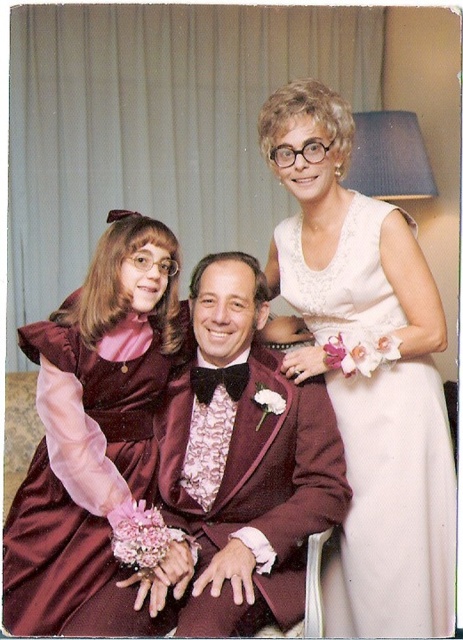
Question: Which point appears farthest from the camera in this image?

Choices:
 (A) (37, 618)
 (B) (435, 484)

Answer: (B)

Question: Does white satin dress at upper right appear over velvet burgundy dress at left?

Choices:
 (A) no
 (B) yes

Answer: (B)

Question: Does white satin dress at upper right have a greater width compared to velvet burgundy dress at left?

Choices:
 (A) yes
 (B) no

Answer: (A)

Question: Is white satin dress at upper right to the right of velvet burgundy dress at left from the viewer's perspective?

Choices:
 (A) no
 (B) yes

Answer: (B)